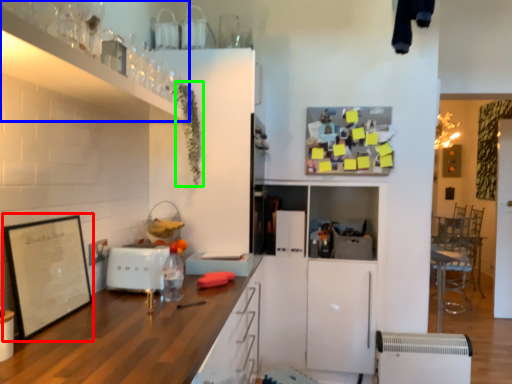
Question: Considering the real-world distances, which object is farthest from picture frame (highlighted by a red box)? cabinetry (highlighted by a blue box) or plant (highlighted by a green box)?

Choices:
 (A) cabinetry
 (B) plant

Answer: (B)